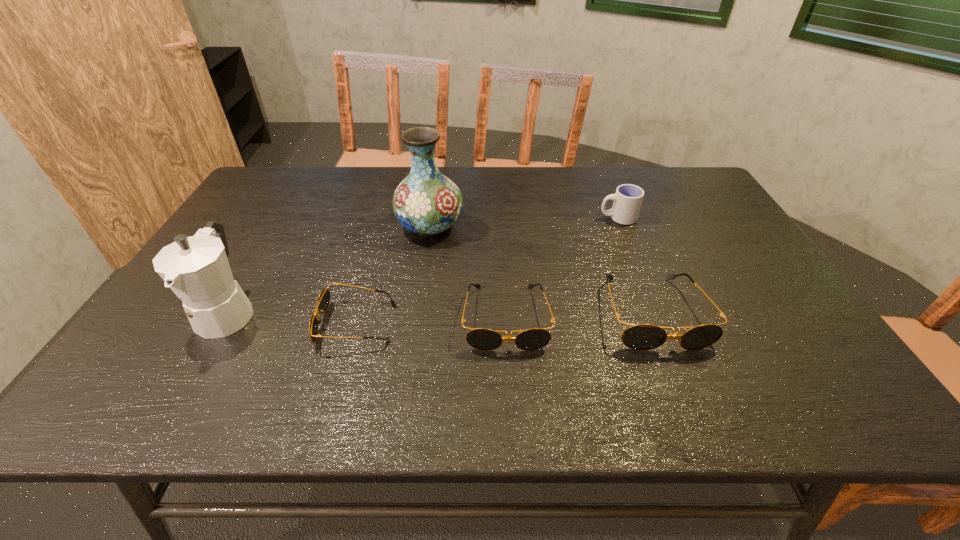
I want to click on vacant point at the near edge, so click(513, 349).

I want to click on vacant space at the right edge, so click(x=726, y=266).

Find the location of a particular element. vacant region at the far left corner of the desktop is located at coordinates (x=286, y=169).

The width and height of the screenshot is (960, 540). In the image, there is a desktop. Identify the location of free space at the near left corner. (132, 353).

Identify the location of vacant area that lies between the rightmost sunglasses and the vase. (541, 269).

This screenshot has height=540, width=960. Find the location of `free area in between the tallest object and the cup`. free area in between the tallest object and the cup is located at coordinates (524, 222).

Identify the location of free space between the shortest sunglasses and the second tallest object. The height and width of the screenshot is (540, 960). (292, 318).

Where is `vacant space that is in between the shortest sunglasses and the vase`? Image resolution: width=960 pixels, height=540 pixels. vacant space that is in between the shortest sunglasses and the vase is located at coordinates (393, 274).

The image size is (960, 540). In order to click on free space between the second sunglasses from left to right and the shortest sunglasses in this screenshot , I will do click(431, 321).

Identify the location of free area in between the rightmost sunglasses and the cup. (635, 265).